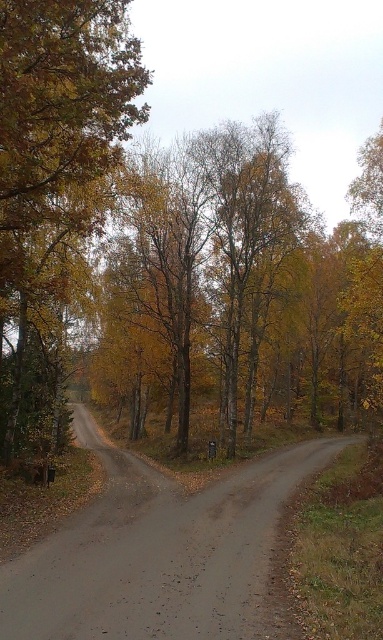
Question: Among these points, which one is farthest from the camera?

Choices:
 (A) (201, 550)
 (B) (57, 236)

Answer: (B)

Question: Which point is farther from the camera taking this photo?

Choices:
 (A) (263, 513)
 (B) (47, 88)

Answer: (A)

Question: Does yellow-green foliage at left appear over gray gravel road at center?

Choices:
 (A) no
 (B) yes

Answer: (B)

Question: Is yellow-green foliage at left to the left of gray gravel road at center from the viewer's perspective?

Choices:
 (A) no
 (B) yes

Answer: (B)

Question: Does yellow-green foliage at left lie in front of gray gravel road at center?

Choices:
 (A) yes
 (B) no

Answer: (B)

Question: Which point is farther from the camera taking this photo?

Choices:
 (A) (1, 618)
 (B) (68, 106)

Answer: (B)